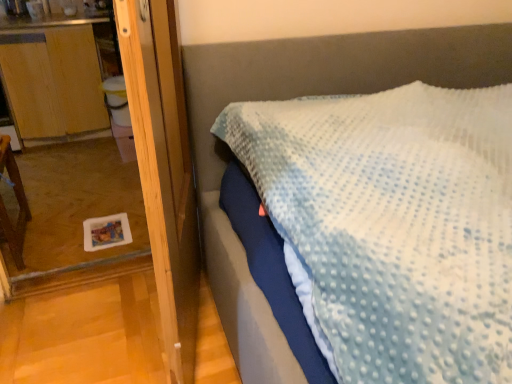
What are the coordinates of `brown wooden chair at left` in the screenshot? It's located at (18, 204).

At what (x,y) coordinates should I click in order to perform the action: click on wooden dresser at left. Please return your answer as a coordinate pair (x, y). Image resolution: width=512 pixels, height=384 pixels. Looking at the image, I should click on (53, 81).

Locate an element on the screen. The image size is (512, 384). brown wooden chair at left is located at coordinates (18, 204).

Locate an element on the screen. This screenshot has height=384, width=512. screen door in front of the wooden dresser at left is located at coordinates (164, 168).

Considering the positions of points (179, 189) and (9, 97), is point (179, 189) closer to camera compared to point (9, 97)?

Yes, it is in front of point (9, 97).

Considering the relative positions of wooden screen door at left and wooden dresser at left in the image provided, is wooden screen door at left in front of wooden dresser at left?

Yes, the depth of wooden screen door at left is less than that of wooden dresser at left.

From the image's perspective, is wooden screen door at left over wooden dresser at left?

Actually, wooden screen door at left appears below wooden dresser at left in the image.

Is point (39, 34) closer to camera compared to point (4, 148)?

No, it is not.

Is wooden dresser at left turned away from brown wooden chair at left?

No, wooden dresser at left is not facing away from brown wooden chair at left.

Is wooden dresser at left positioned beyond the bounds of brown wooden chair at left?

Yes, wooden dresser at left is outside of brown wooden chair at left.

This screenshot has width=512, height=384. I want to click on furniture below the wooden dresser at left (from the image's perspective), so click(18, 204).

Is wooden screen door at left wider than brown wooden chair at left?

Incorrect, the width of wooden screen door at left does not surpass that of brown wooden chair at left.

Can you confirm if wooden screen door at left is positioned to the left of brown wooden chair at left?

No, wooden screen door at left is not to the left of brown wooden chair at left.

Is there a large distance between wooden screen door at left and brown wooden chair at left?

Yes, wooden screen door at left and brown wooden chair at left are located far from each other.

What's the angular difference between wooden screen door at left and brown wooden chair at left's facing directions?

The angle between the facing direction of wooden screen door at left and the facing direction of brown wooden chair at left is 73.7 degrees.

In the scene shown: Would you consider brown wooden chair at left to be distant from wooden dresser at left?

Yes, brown wooden chair at left is far from wooden dresser at left.

Can you tell me how much brown wooden chair at left and wooden dresser at left differ in facing direction?

The facing directions of brown wooden chair at left and wooden dresser at left are 179 degrees apart.

Is brown wooden chair at left located outside wooden dresser at left?

brown wooden chair at left is positioned outside wooden dresser at left.

From a real-world perspective, is brown wooden chair at left on top of wooden dresser at left?

No.

Is brown wooden chair at left not close to wooden screen door at left?

brown wooden chair at left is far away from wooden screen door at left.

From a real-world perspective, is brown wooden chair at left above or below wooden screen door at left?

In terms of real-world spatial position, brown wooden chair at left is below wooden screen door at left.

Which is in front, brown wooden chair at left or wooden screen door at left?

Positioned in front is wooden screen door at left.

Based on the photo, does brown wooden chair at left appear on the left side of wooden screen door at left?

Correct, you'll find brown wooden chair at left to the left of wooden screen door at left.

Is wooden dresser at left spatially inside wooden screen door at left, or outside of it?

wooden dresser at left is located beyond the bounds of wooden screen door at left.

Identify the location of dresser directly beneath the wooden screen door at left (from a real-world perspective). The height and width of the screenshot is (384, 512). (53, 81).

From a real-world perspective, is wooden dresser at left positioned above or below wooden screen door at left?

wooden dresser at left is situated lower than wooden screen door at left in the real world.

Is wooden dresser at left in front of or behind wooden screen door at left in the image?

Clearly, wooden dresser at left is behind wooden screen door at left.

Locate an element on the screen. dresser that appears below the wooden screen door at left (from a real-world perspective) is located at coordinates (53, 81).

Locate an element on the screen. furniture in front of the wooden dresser at left is located at coordinates (18, 204).

Considering their positions, is brown wooden chair at left positioned closer to wooden dresser at left than wooden screen door at left?

The object closer to wooden dresser at left is brown wooden chair at left.

Estimate the real-world distances between objects in this image. Which object is further from wooden screen door at left, brown wooden chair at left or wooden dresser at left?

wooden dresser at left is positioned further to the anchor wooden screen door at left.

Based on the photo, looking at the image, which one is located further to brown wooden chair at left, wooden screen door at left or wooden dresser at left?

wooden screen door at left is positioned further to the anchor brown wooden chair at left.

From the image, which object appears to be nearer to brown wooden chair at left, wooden dresser at left or wooden screen door at left?

Based on the image, wooden dresser at left appears to be nearer to brown wooden chair at left.

Looking at the image, which one is located closer to wooden screen door at left, wooden dresser at left or brown wooden chair at left?

brown wooden chair at left lies closer to wooden screen door at left than the other object.

Based on their spatial positions, is wooden screen door at left or brown wooden chair at left further from wooden dresser at left?

Among the two, wooden screen door at left is located further to wooden dresser at left.

Where is `furniture between wooden screen door at left and wooden dresser at left from front to back`? furniture between wooden screen door at left and wooden dresser at left from front to back is located at coordinates (18, 204).